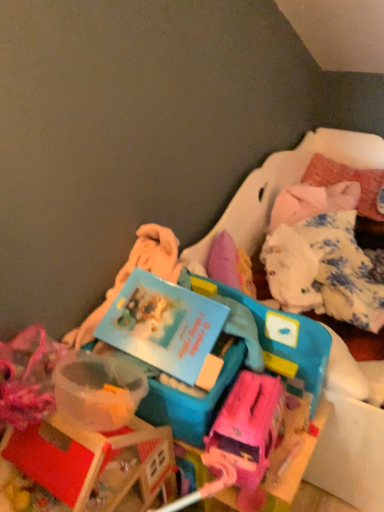
Question: Considering the positions of blue plastic book at center and matte pink suitcase at center in the image, is blue plastic book at center taller or shorter than matte pink suitcase at center?

Choices:
 (A) short
 (B) tall

Answer: (B)

Question: Which is correct: blue plastic book at center is inside matte pink suitcase at center, or outside of it?

Choices:
 (A) inside
 (B) outside

Answer: (B)

Question: Based on their relative distances, which object is farther from the blue plastic storage box at center, which ranks as the 1th storage box in right-to-left order?

Choices:
 (A) fluffy pink pillow at upper right
 (B) matte pink suitcase at center
 (C) blue plastic book at center
 (D) blue plastic storage box at center, which is counted as the 1th storage box, starting from the left

Answer: (A)

Question: Which of these objects is positioned closest to the blue plastic storage box at center, which is counted as the 1th storage box, starting from the left?

Choices:
 (A) fluffy pink pillow at upper right
 (B) blue plastic storage box at center, which ranks as the second storage box in left-to-right order
 (C) blue plastic book at center
 (D) matte pink suitcase at center

Answer: (C)